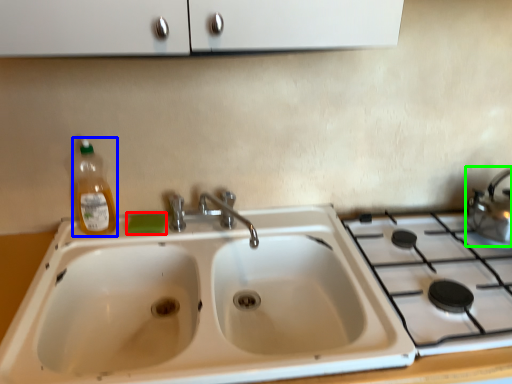
Question: Which object is the closest to the soap (highlighted by a red box)? Choose among these: bottle (highlighted by a blue box) or tea pot (highlighted by a green box).

Choices:
 (A) bottle
 (B) tea pot

Answer: (A)